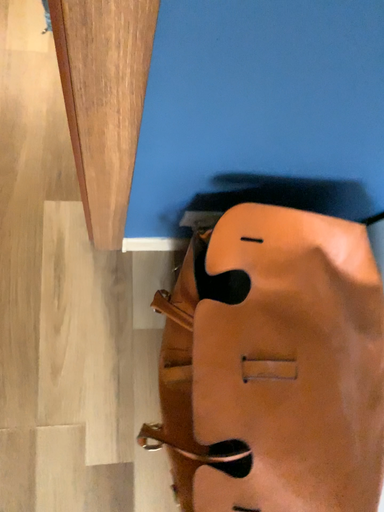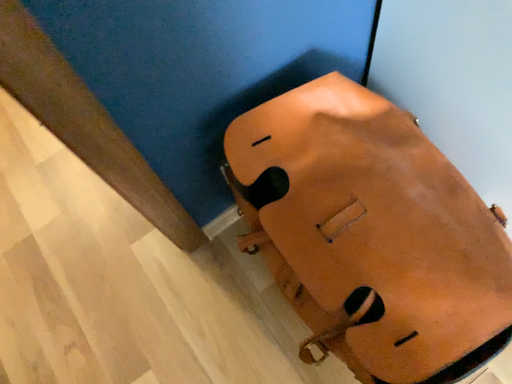
Question: How did the camera likely rotate when shooting the video?

Choices:
 (A) rotated right
 (B) rotated left

Answer: (B)